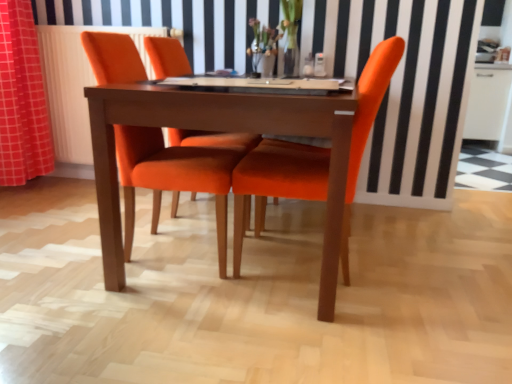
Question: Which is correct: orange fabric curtain at left is inside orange fabric chair at center, the 2th chair when ordered from right to left, or outside of it?

Choices:
 (A) outside
 (B) inside

Answer: (A)

Question: Is orange fabric curtain at left in front of or behind orange fabric chair at center, the 2th chair when ordered from right to left, in the image?

Choices:
 (A) front
 (B) behind

Answer: (B)

Question: Estimate the real-world distances between objects in this image. Which object is closer to the orange fabric curtain at left?

Choices:
 (A) orange fabric chair at center, the first chair when ordered from right to left
 (B) white radiator at left
 (C) wooden table at center
 (D) orange fabric chair at center, positioned as the 1th chair in left-to-right order

Answer: (B)

Question: Which object is the farthest from the orange fabric curtain at left?

Choices:
 (A) orange fabric chair at center, which appears as the second chair when viewed from the left
 (B) wooden table at center
 (C) white radiator at left
 (D) orange fabric chair at center, the 2th chair when ordered from right to left

Answer: (A)